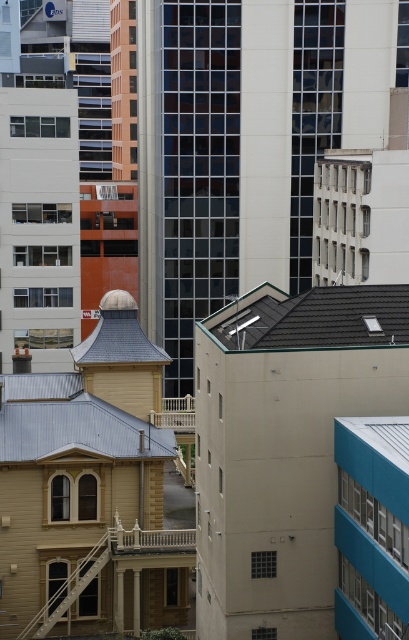
Question: Which point is closer to the camera taking this photo?

Choices:
 (A) (258, 300)
 (B) (78, 449)

Answer: (A)

Question: Does gray tile roof at center have a greater width compared to metallic gray roof at center?

Choices:
 (A) no
 (B) yes

Answer: (A)

Question: Which of the following is the farthest from the observer?

Choices:
 (A) gray tile roof at center
 (B) metallic gray roof at center

Answer: (B)

Question: Is gray tile roof at center in front of metallic gray roof at center?

Choices:
 (A) yes
 (B) no

Answer: (A)

Question: Is gray tile roof at center bigger than metallic gray roof at center?

Choices:
 (A) yes
 (B) no

Answer: (B)

Question: Which of the following is the farthest from the observer?

Choices:
 (A) metallic gray roof at center
 (B) gray tile roof at center

Answer: (A)